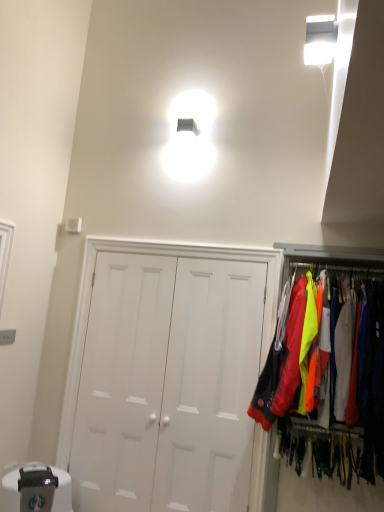
What do you see at coordinates (170, 376) in the screenshot?
I see `white matte door at center` at bounding box center [170, 376].

This screenshot has width=384, height=512. Identify the location of white matte door at center. (170, 376).

Measure the distance between point (x=164, y=444) and camera.

They are 3.10 meters apart.

What do you see at coordinates (369, 398) in the screenshot? I see `neon fabric jackets at right` at bounding box center [369, 398].

Where is `neon fabric jackets at right`? The width and height of the screenshot is (384, 512). neon fabric jackets at right is located at coordinates (369, 398).

In order to click on white matte door at center in this screenshot , I will do `click(170, 376)`.

Does neon fabric jackets at right appear on the right side of white matte door at center?

Indeed, neon fabric jackets at right is positioned on the right side of white matte door at center.

Does neon fabric jackets at right lie behind white matte door at center?

No, it is not.

Which is less distant, (364, 317) or (143, 271)?

Point (364, 317)

From the image's perspective, relative to white matte door at center, is neon fabric jackets at right above or below?

From the image's perspective, neon fabric jackets at right appears above white matte door at center.

From a real-world perspective, who is located higher, neon fabric jackets at right or white matte door at center?

From a 3D spatial view, neon fabric jackets at right is above.

Is neon fabric jackets at right thinner than white matte door at center?

Incorrect, the width of neon fabric jackets at right is not less than that of white matte door at center.

Is neon fabric jackets at right taller than white matte door at center?

Incorrect, the height of neon fabric jackets at right is not larger of that of white matte door at center.

In terms of size, does neon fabric jackets at right appear bigger or smaller than white matte door at center?

neon fabric jackets at right is bigger than white matte door at center.

Is neon fabric jackets at right inside the boundaries of white matte door at center, or outside?

neon fabric jackets at right is not inside white matte door at center, it's outside.

Are neon fabric jackets at right and white matte door at center making contact?

No, neon fabric jackets at right is not in contact with white matte door at center.

Is neon fabric jackets at right positioned with its back to white matte door at center?

No.

How different are the orientations of neon fabric jackets at right and white matte door at center in degrees?

They differ by 0.81 degrees in their facing directions.

This screenshot has width=384, height=512. Identify the location of closet that appears above the white matte door at center (from a real-world perspective). (369, 398).

Considering the relative positions of white matte door at center and neon fabric jackets at right in the image provided, is white matte door at center to the left or to the right of neon fabric jackets at right?

From the image, it's evident that white matte door at center is to the left of neon fabric jackets at right.

Considering the positions of objects white matte door at center and neon fabric jackets at right in the image provided, who is behind, white matte door at center or neon fabric jackets at right?

white matte door at center is behind.

Which is closer to the camera, (132, 319) or (265, 394)?

Point (132, 319) is farther from the camera than point (265, 394).

From the image's perspective, is white matte door at center over neon fabric jackets at right?

Actually, white matte door at center appears below neon fabric jackets at right in the image.

From a real-world perspective, which object rests below the other?

In real-world perspective, white matte door at center is lower.

Does white matte door at center have a lesser width compared to neon fabric jackets at right?

Yes.

Does white matte door at center have a greater height compared to neon fabric jackets at right?

Yes, white matte door at center is taller than neon fabric jackets at right.

Who is smaller, white matte door at center or neon fabric jackets at right?

white matte door at center is smaller.

Is white matte door at center completely or partially outside of neon fabric jackets at right?

Yes, white matte door at center is outside of neon fabric jackets at right.

Are white matte door at center and neon fabric jackets at right far apart?

They are positioned close to each other.

In the scene shown: Is white matte door at center aimed at neon fabric jackets at right?

No, white matte door at center is not turned towards neon fabric jackets at right.

Find the location of `closet located above the white matte door at center (from the image's perspective)`. closet located above the white matte door at center (from the image's perspective) is located at coordinates (369, 398).

This screenshot has height=512, width=384. I want to click on closet above the white matte door at center (from a real-world perspective), so click(369, 398).

Where is `door that appears below the neon fabric jackets at right (from the image's perspective)`? This screenshot has width=384, height=512. door that appears below the neon fabric jackets at right (from the image's perspective) is located at coordinates (170, 376).